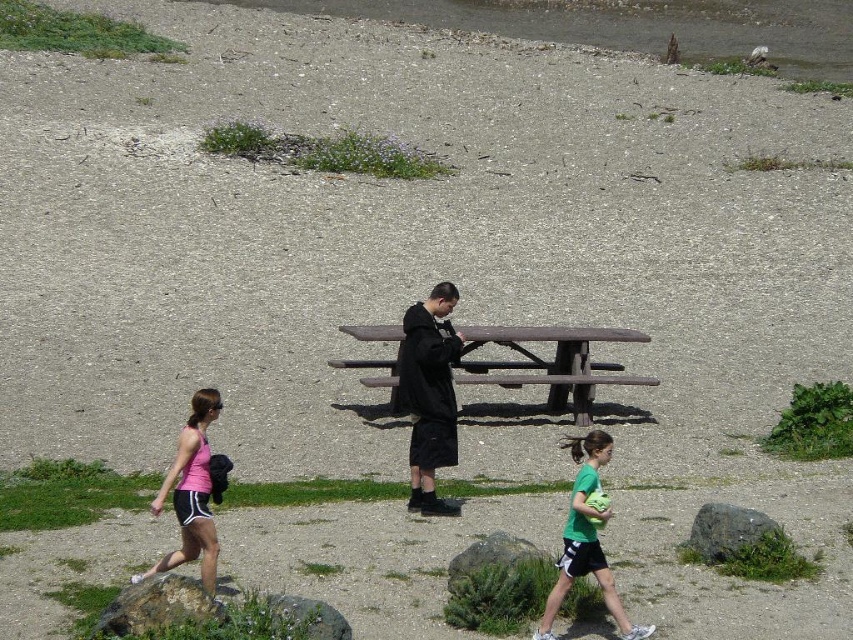
Which of these two, brown wooden bench at center or gray rough rock at center, stands taller?

With more height is brown wooden bench at center.

Who is shorter, brown wooden bench at center or gray rough rock at center?

Standing shorter between the two is gray rough rock at center.

Which is behind, point (349, 365) or point (694, 552)?

The point (349, 365) is more distant.

Locate an element on the screen. The image size is (853, 640). brown wooden bench at center is located at coordinates pos(550,364).

Is point (578, 436) positioned behind point (508, 561)?

Yes.

Does green matte shirt at lower center appear on the left side of gray rock at lower center?

In fact, green matte shirt at lower center is to the right of gray rock at lower center.

Is point (610, 589) closer to camera compared to point (451, 580)?

Yes, point (610, 589) is in front of point (451, 580).

The image size is (853, 640). I want to click on green matte shirt at lower center, so click(585, 540).

Can you confirm if pink fabric tank top at lower left is positioned to the right of rough textured rock at lower left?

No, pink fabric tank top at lower left is not to the right of rough textured rock at lower left.

Is point (161, 564) positioned after point (149, 621)?

Yes.

This screenshot has width=853, height=640. I want to click on pink fabric tank top at lower left, so [x=190, y=492].